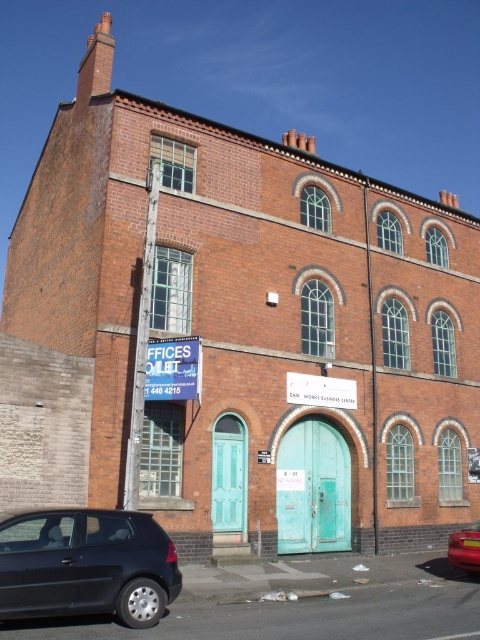
You are a delivery driver who needs to park your truck, which is 5 meters long, near the building. You see the matte black hatchback at lower left and the metallic red car at lower right parked nearby. Can you determine if there is enough space between them to park your truck?

The matte black hatchback at lower left is shorter than the metallic red car at lower right, but the exact distance between them isn not provided. Without knowing the gap between the two cars, it is impossible to determine if there is enough space for the 5 meter long truck.

You are driving a car and need to park in front of the ZAIR WORKS BUSINESS CENTRE. The parking spot is at point 0.883, 0.179. Is the matte black hatchback at lower left blocking your parking spot?

The matte black hatchback at lower left is located at point [85,564], so yes, it is blocking the parking spot at that coordinate.

You are a delivery driver who needs to park your vehicle in the parking lot near the ZAIR WORKS BUSINESS CENTRE. You see a matte black hatchback at lower left and a metallic red car at lower right. Which car is parked closer to the entrance of the building?

The matte black hatchback at lower left is above the metallic red car at lower right, meaning it is parked closer to the entrance of the building.